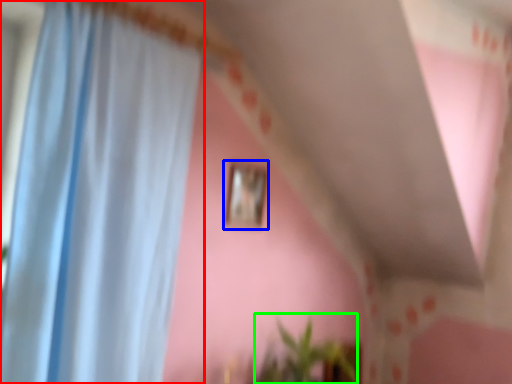
Question: Based on their relative distances, which object is nearer to curtain (highlighted by a red box)? Choose from picture frame (highlighted by a blue box) and plant (highlighted by a green box).

Choices:
 (A) picture frame
 (B) plant

Answer: (A)